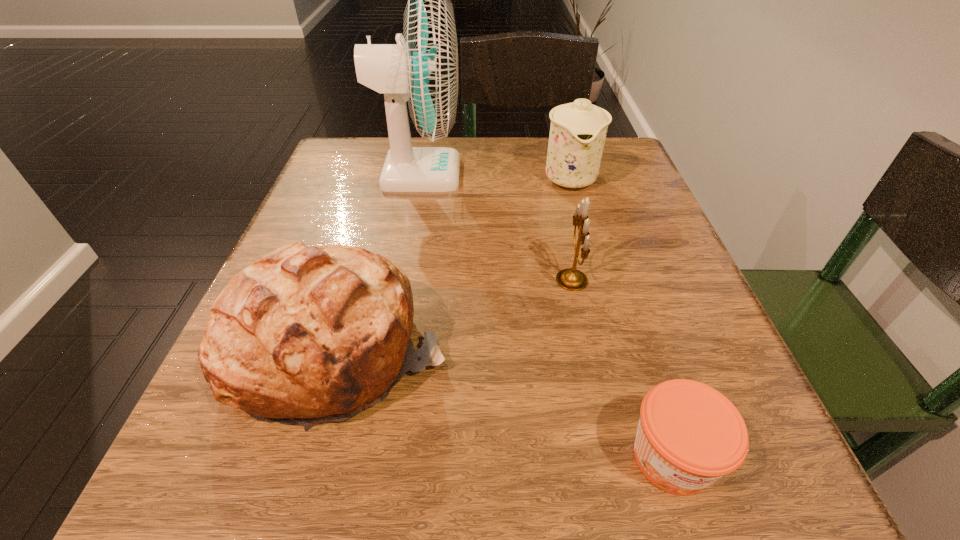
Where is `chinaware that is at the far edge`? This screenshot has height=540, width=960. chinaware that is at the far edge is located at coordinates (578, 130).

You are a GUI agent. You are given a task and a screenshot of the screen. Output one action in this format:
    pyautogui.click(x=<x>, y=<y>)
    Task: Click on the object present at the near edge
    This screenshot has height=540, width=960.
    Given the screenshot: What is the action you would take?
    pyautogui.click(x=689, y=435)

The width and height of the screenshot is (960, 540). I want to click on fan that is at the left edge, so click(x=423, y=70).

Identify the location of bread that is at the left edge. (305, 335).

The width and height of the screenshot is (960, 540). In order to click on chinaware that is at the right edge in this screenshot , I will do coord(578,130).

At what (x,y) coordinates should I click in order to perform the action: click on jam situated at the right edge. Please return your answer as a coordinate pair (x, y). The height and width of the screenshot is (540, 960). Looking at the image, I should click on (689, 435).

At what (x,y) coordinates should I click in order to perform the action: click on object that is at the far left corner. Please return your answer as a coordinate pair (x, y). The width and height of the screenshot is (960, 540). Looking at the image, I should click on (423, 70).

Locate an element on the screen. This screenshot has height=540, width=960. object positioned at the far right corner is located at coordinates (578, 130).

The width and height of the screenshot is (960, 540). Find the location of `object located at the near right corner`. object located at the near right corner is located at coordinates (689, 435).

Image resolution: width=960 pixels, height=540 pixels. Find the location of `vacant region at the far edge`. vacant region at the far edge is located at coordinates (435, 194).